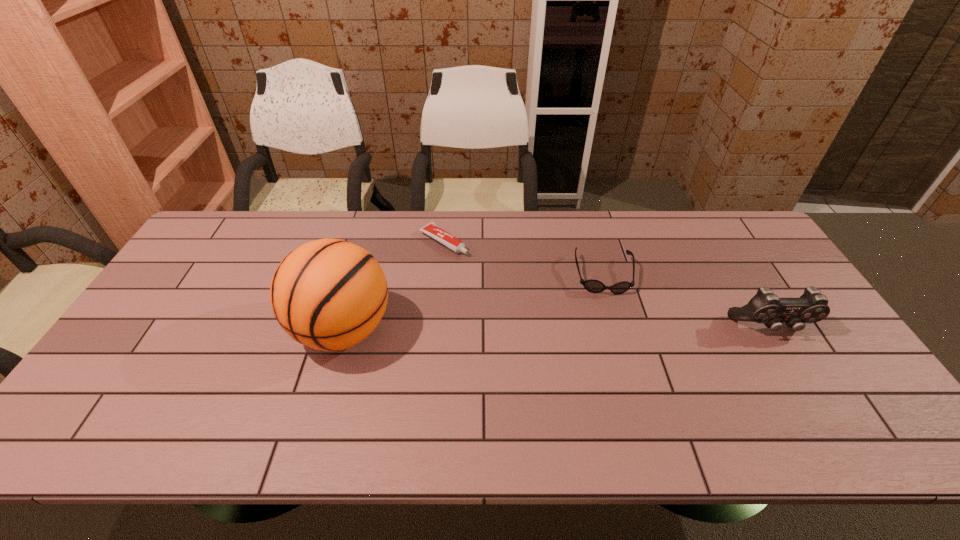
Where is `free spot at the left edge of the desktop`? The width and height of the screenshot is (960, 540). free spot at the left edge of the desktop is located at coordinates (161, 347).

Locate an element on the screen. vacant region at the near left corner of the desktop is located at coordinates (142, 387).

You are a GUI agent. You are given a task and a screenshot of the screen. Output one action in this format:
    pyautogui.click(x=<x>, y=<y>)
    Task: Click on the vacant space at the far right corner
    The image size is (960, 540).
    Given the screenshot: What is the action you would take?
    pyautogui.click(x=721, y=226)

Where is `unoccupied area between the toothpaste and the tallest object`? The image size is (960, 540). unoccupied area between the toothpaste and the tallest object is located at coordinates (393, 286).

Locate an element on the screen. Image resolution: width=960 pixels, height=540 pixels. vacant space that's between the sunglasses and the shortest object is located at coordinates (523, 258).

Locate an element on the screen. Image resolution: width=960 pixels, height=540 pixels. free space between the toothpaste and the rightmost object is located at coordinates (608, 285).

The height and width of the screenshot is (540, 960). In order to click on free space between the shortest object and the leftmost object in this screenshot , I will do `click(393, 286)`.

At what (x,y) coordinates should I click in order to perform the action: click on free space that is in between the second shortest object and the second object from left to right. Please return your answer as a coordinate pair (x, y). The height and width of the screenshot is (540, 960). Looking at the image, I should click on (523, 258).

The image size is (960, 540). I want to click on empty location between the shortest object and the basketball, so click(393, 286).

Identify the location of vacant point located between the toothpaste and the rightmost object. (608, 285).